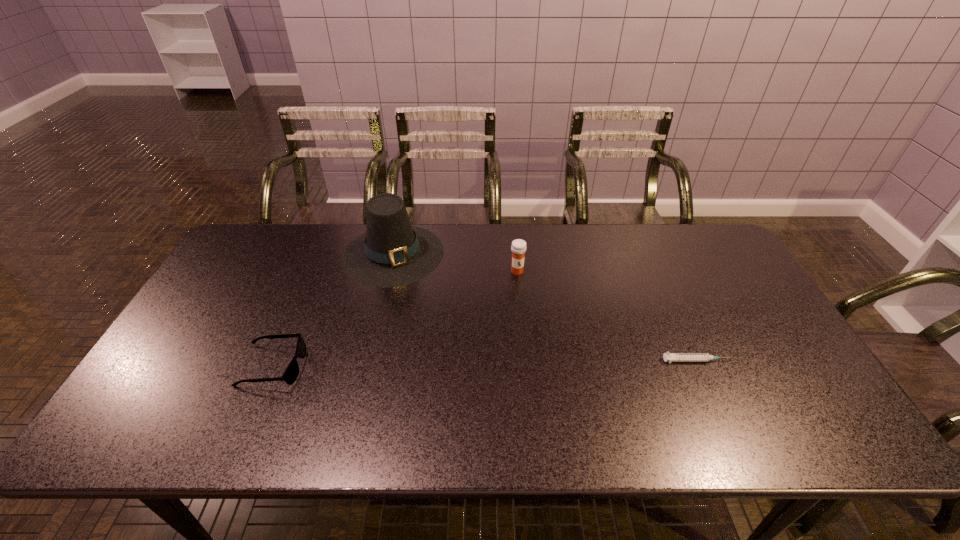
Where is `free region located on the front-facing side of the tallest object`? This screenshot has height=540, width=960. free region located on the front-facing side of the tallest object is located at coordinates (406, 299).

This screenshot has width=960, height=540. Find the location of `free space located 0.160m on the label side of the second tallest object`. free space located 0.160m on the label side of the second tallest object is located at coordinates (528, 313).

The width and height of the screenshot is (960, 540). In order to click on free region located on the label side of the second tallest object in this screenshot , I will do `click(521, 287)`.

Find the location of a particular element. free space located on the label side of the second tallest object is located at coordinates (534, 334).

I want to click on hat that is at the far edge, so click(392, 253).

Where is `medicine that is at the far edge`? medicine that is at the far edge is located at coordinates (518, 247).

At what (x,y) coordinates should I click in order to perform the action: click on object that is positioned at the near edge. Please return your answer as a coordinate pair (x, y). Looking at the image, I should click on (291, 373).

Find the location of a particular element. The image size is (960, 540). vacant position at the far edge of the desktop is located at coordinates (501, 225).

This screenshot has width=960, height=540. I want to click on vacant space at the near edge of the desktop, so click(x=539, y=396).

In the image, there is a desktop. At what (x,y) coordinates should I click in order to perform the action: click on vacant space at the left edge. Please return your answer as a coordinate pair (x, y). This screenshot has width=960, height=540. Looking at the image, I should click on (195, 313).